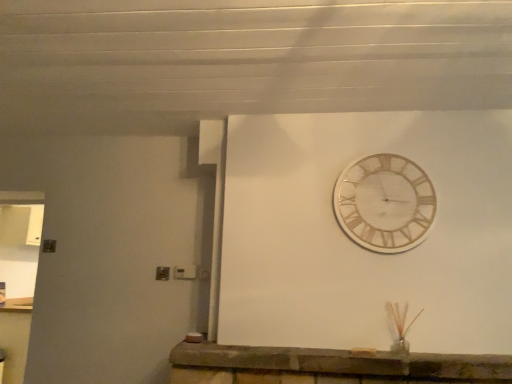
Question: Based on their positions, is white marble clock at upper center located to the left or right of brick stone counter at lower center?

Choices:
 (A) left
 (B) right

Answer: (B)

Question: From a real-world perspective, is white marble clock at upper center physically located above or below brick stone counter at lower center?

Choices:
 (A) above
 (B) below

Answer: (A)

Question: Looking at their shapes, would you say white marble clock at upper center is wider or thinner than brick stone counter at lower center?

Choices:
 (A) thin
 (B) wide

Answer: (A)

Question: Looking at their shapes, would you say brick stone counter at lower center is wider or thinner than white marble clock at upper center?

Choices:
 (A) wide
 (B) thin

Answer: (A)

Question: Would you say brick stone counter at lower center is to the left or to the right of white marble clock at upper center in the picture?

Choices:
 (A) left
 (B) right

Answer: (A)

Question: Considering the positions of point (501, 360) and point (335, 203), is point (501, 360) closer or farther from the camera than point (335, 203)?

Choices:
 (A) closer
 (B) farther

Answer: (A)

Question: From a real-world perspective, is brick stone counter at lower center physically located above or below white marble clock at upper center?

Choices:
 (A) below
 (B) above

Answer: (A)